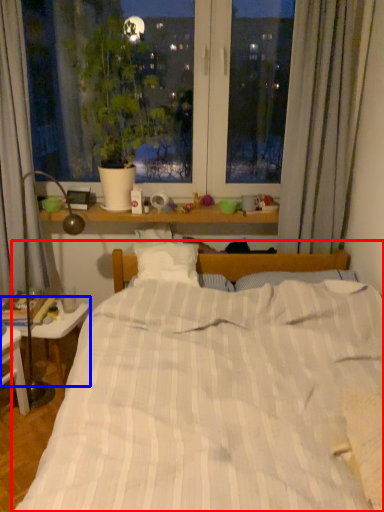
Question: Which object is further to the camera taking this photo, bed (highlighted by a red box) or table (highlighted by a blue box)?

Choices:
 (A) bed
 (B) table

Answer: (B)